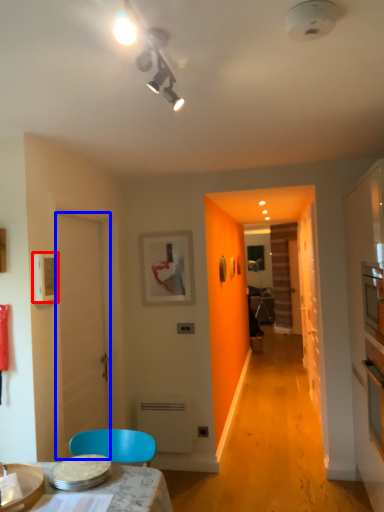
Question: Among these objects, which one is nearest to the camera, picture frame (highlighted by a red box) or door (highlighted by a blue box)?

Choices:
 (A) picture frame
 (B) door

Answer: (A)